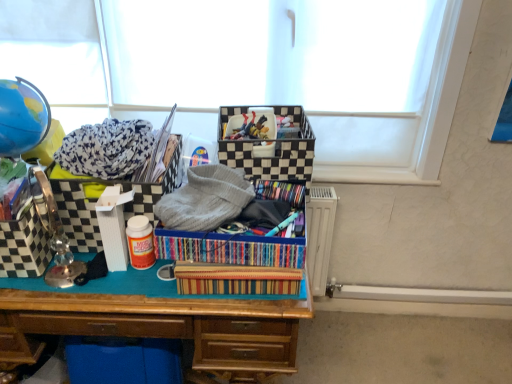
Question: Considering the positions of checkered fabric storage box at left, the 2th storage box positioned from the left, and multicolored striped fabric at center in the image, is checkered fabric storage box at left, the 2th storage box positioned from the left, taller or shorter than multicolored striped fabric at center?

Choices:
 (A) short
 (B) tall

Answer: (B)

Question: Is point (68, 218) closer or farther from the camera than point (162, 246)?

Choices:
 (A) closer
 (B) farther

Answer: (B)

Question: Considering the real-world distances, which object is closest to the checkered fabric storage box at left, which is the 2th storage box from right to left?

Choices:
 (A) multicolored striped fabric at center
 (B) striped fabric crate at center
 (C) checkerboard-patterned storage box at left, acting as the third storage box starting from the right
 (D) gray knitted sweater at center
 (E) wooden desk at center

Answer: (C)

Question: Based on their relative distances, which object is nearer to the checkerboard-patterned storage box at left, acting as the third storage box starting from the right?

Choices:
 (A) black checkered storage box at center, the third storage box in the left-to-right sequence
 (B) checkered fabric storage box at left, which is the 2th storage box from right to left
 (C) multicolored striped fabric at center
 (D) gray knitted sweater at center
 (E) striped fabric crate at center

Answer: (B)